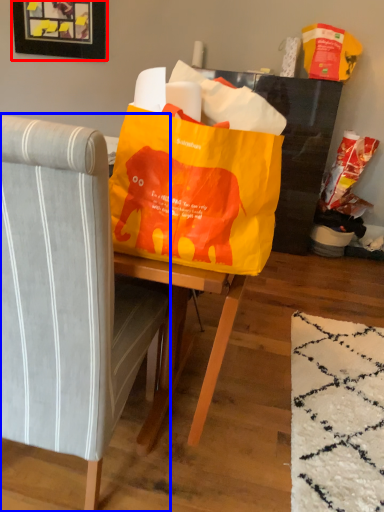
Question: Which object appears closest to the camera in this image, picture frame (highlighted by a red box) or chair (highlighted by a blue box)?

Choices:
 (A) picture frame
 (B) chair

Answer: (B)